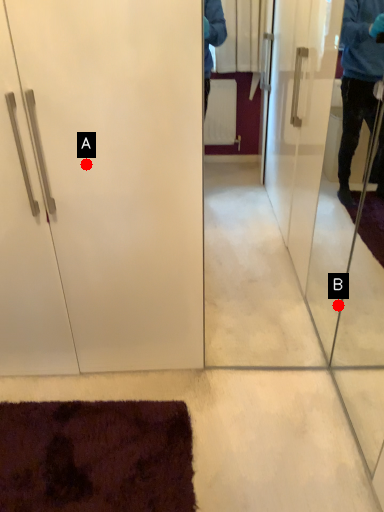
Question: Two points are circled on the image, labeled by A and B beside each circle. Which of the following is the farthest from the observer?

Choices:
 (A) A is further
 (B) B is further

Answer: (B)